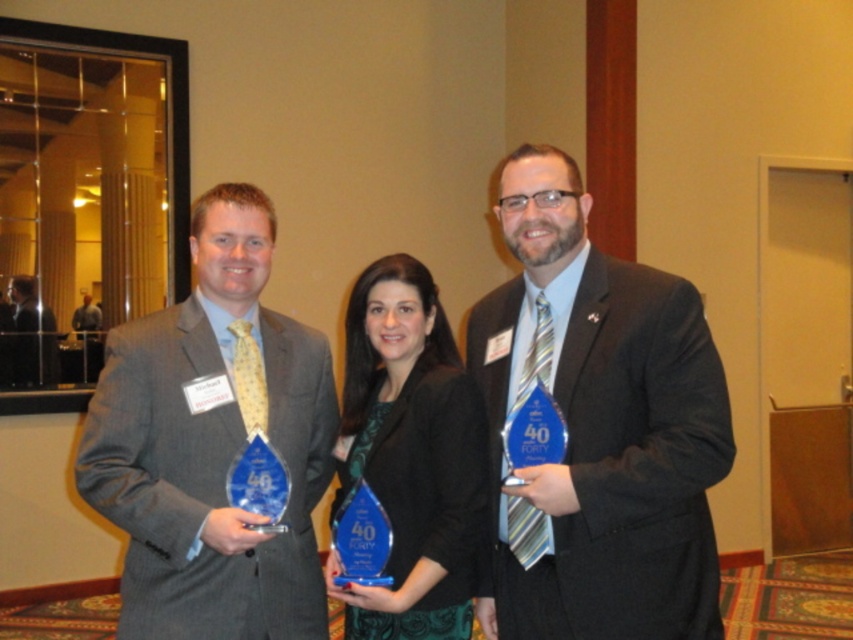
Question: Which object is the closest to the matte black suit at center?

Choices:
 (A) matte gray suit at center
 (B) matte blue glass award at center
 (C) matte black suit at left

Answer: (B)

Question: Among these points, which one is farthest from the camera?

Choices:
 (A) (376, 632)
 (B) (27, 301)
 (C) (677, 580)
 (D) (131, 634)

Answer: (B)

Question: Can you confirm if matte black suit at center is wider than matte black suit at left?

Choices:
 (A) no
 (B) yes

Answer: (B)

Question: Can you confirm if matte black suit at center is positioned below matte black suit at left?

Choices:
 (A) yes
 (B) no

Answer: (A)

Question: Among these points, which one is nearest to the camera?

Choices:
 (A) (292, 456)
 (B) (604, 563)
 (C) (22, 323)

Answer: (B)

Question: Does matte blue glass award at center have a smaller size compared to matte black suit at left?

Choices:
 (A) no
 (B) yes

Answer: (A)